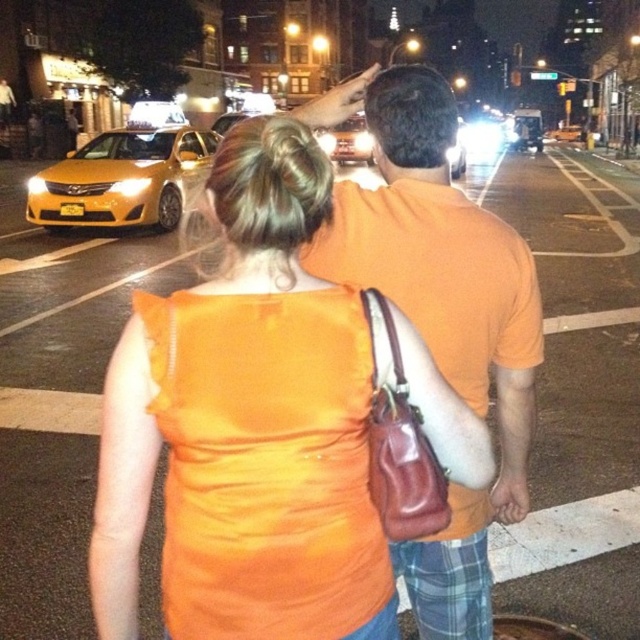
Does yellow matte taxi at left appear under shiny silver car at center?

Correct, yellow matte taxi at left is located below shiny silver car at center.

Is yellow matte taxi at left taller than shiny silver car at center?

In fact, yellow matte taxi at left may be shorter than shiny silver car at center.

Is point (56, 198) positioned after point (364, 161)?

No, (56, 198) is in front of (364, 161).

Find the location of a particular element. Image resolution: width=640 pixels, height=640 pixels. yellow matte taxi at left is located at coordinates (122, 179).

Between orange matte shirt at center and shiny silver car at center, which one has less height?

orange matte shirt at center

Is orange matte shirt at center to the left of shiny silver car at center from the viewer's perspective?

Yes, orange matte shirt at center is to the left of shiny silver car at center.

Is point (333, 202) positioned behind point (358, 138)?

No, it is in front of (358, 138).

You are a GUI agent. You are given a task and a screenshot of the screen. Output one action in this format:
    pyautogui.click(x=<x>, y=<y>)
    Task: Click on the orange matte shirt at center
    
    Given the screenshot: What is the action you would take?
    coord(438,314)

Measure the distance from orange satin dress at center to orange matte shirt at center.

31.58 inches

Which is above, orange satin dress at center or orange matte shirt at center?

orange satin dress at center is higher up.

Who is more forward, (228, 492) or (337, 88)?

Point (228, 492) is more forward.

Where is `orange satin dress at center`? The width and height of the screenshot is (640, 640). orange satin dress at center is located at coordinates (276, 404).